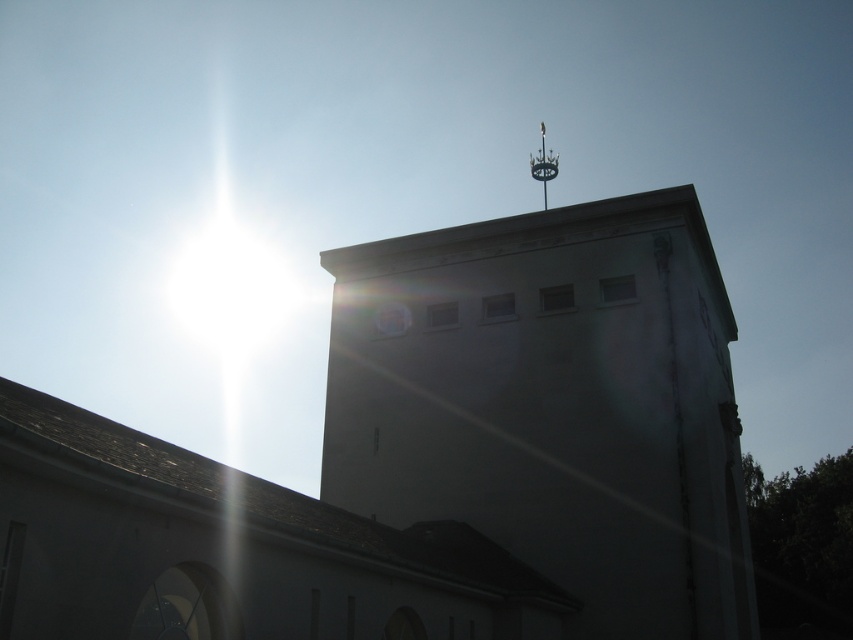
You are an architect reviewing the building design. You notice the white matte tower at upper center and the polished metal spire at upper center. Which one appears closer to the observer in the design?

The white matte tower at upper center is in front of the polished metal spire at upper center, so it appears closer to the observer in the design.

Based on the scene description, where is the white matte tower at upper center located in terms of coordinates?

The white matte tower at upper center is located at coordinates point (428, 460).